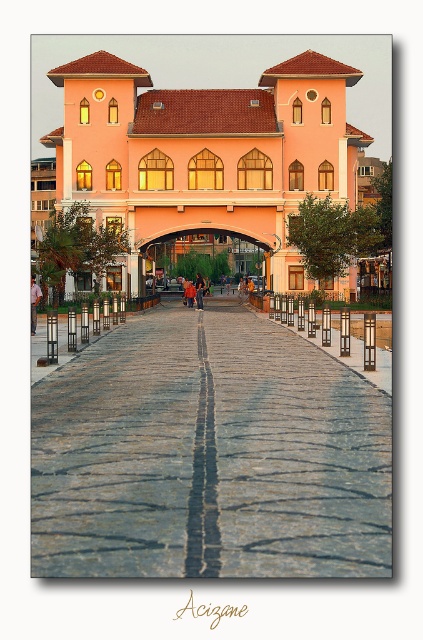
You are standing on the cobblestone walkway in front of the building and see both the matte pink dress at center and the orange fabric person at center. Which one is positioned to the left side from your perspective?

→ The matte pink dress at center is positioned to the left of the orange fabric person at center, so the matte pink dress at center is on the left side from your perspective.

You are standing on the gray cobblestone pavement at center and want to reach the orange fabric person at center. Which direction should you move to get closer to them?

Since the gray cobblestone pavement at center is closer to the viewer than the orange fabric person at center, you should move forward along the pavement towards the orange fabric person at center to get closer to them.

You are standing at the entrance of the pink building and want to walk towards the orange fabric person at center. Which direction should you walk relative to the gray cobblestone pavement at center?

The gray cobblestone pavement at center is positioned on the right side of the orange fabric person at center. To reach the orange fabric person at center, you should walk to the left of the gray cobblestone pavement at center since the person is on its left side.